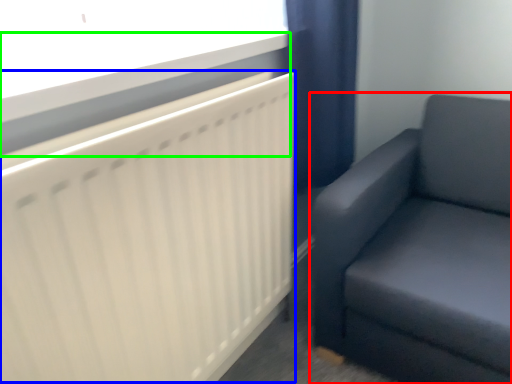
Question: Estimate the real-world distances between objects in this image. Which object is farther from studio couch (highlighted by a red box), radiator (highlighted by a blue box) or window sill (highlighted by a green box)?

Choices:
 (A) radiator
 (B) window sill

Answer: (B)